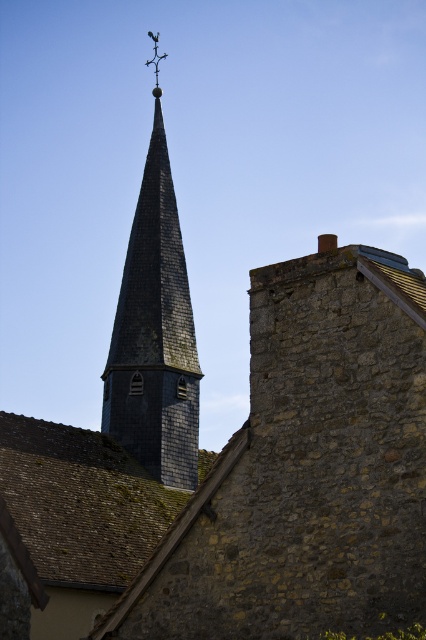
Question: Which point is farther from the camera taking this photo?

Choices:
 (A) (166, 410)
 (B) (158, 58)

Answer: (B)

Question: Which object appears farthest from the camera in this image?

Choices:
 (A) shiny dark gray slate church tower at center
 (B) metallic cross at upper center

Answer: (B)

Question: Is shiny dark gray slate church tower at center bigger than metallic cross at upper center?

Choices:
 (A) no
 (B) yes

Answer: (A)

Question: Does shiny dark gray slate church tower at center appear on the right side of metallic cross at upper center?

Choices:
 (A) yes
 (B) no

Answer: (A)

Question: Which point is closer to the camera?

Choices:
 (A) metallic cross at upper center
 (B) shiny dark gray slate church tower at center

Answer: (B)

Question: Can you confirm if shiny dark gray slate church tower at center is wider than metallic cross at upper center?

Choices:
 (A) yes
 (B) no

Answer: (B)